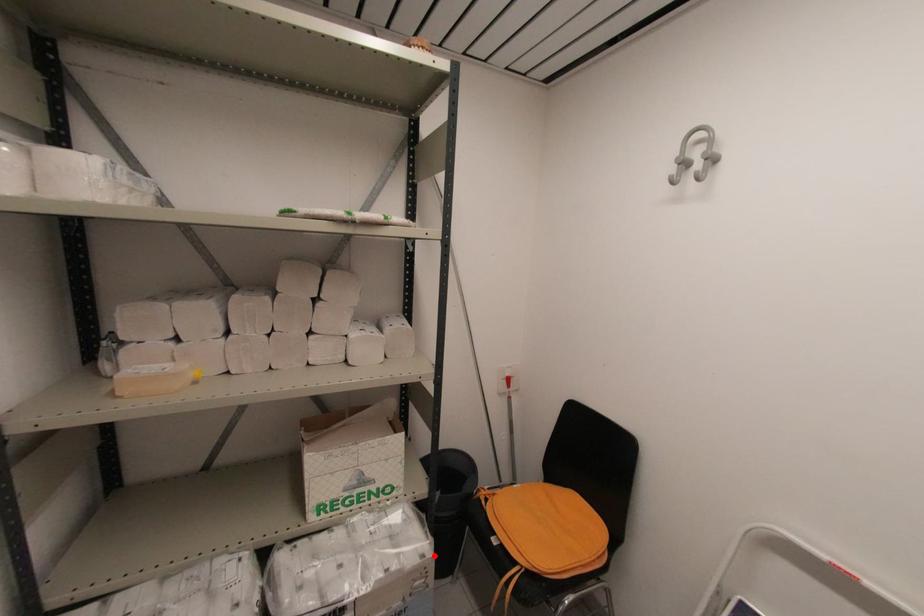
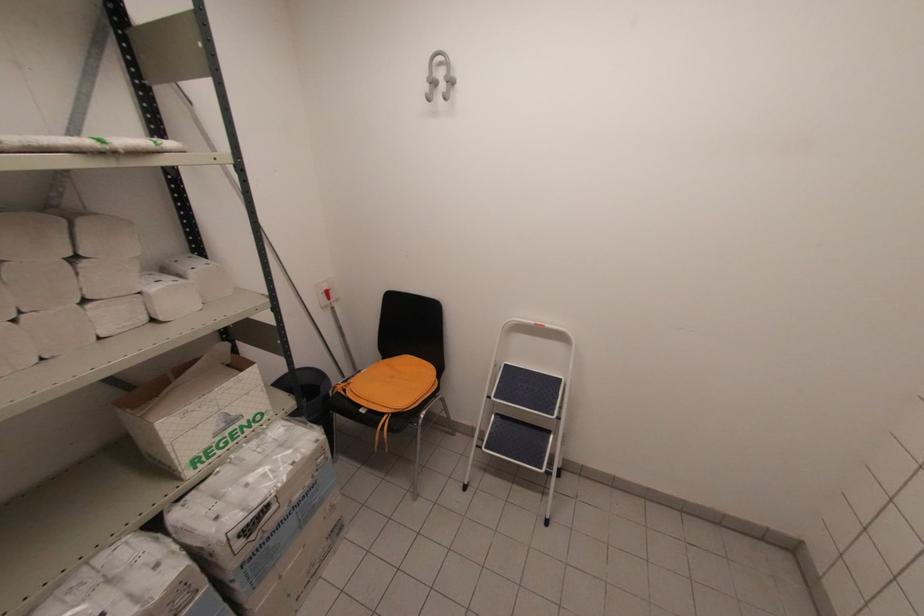
Question: I am providing you with two images of the same scene from different viewpoints. In image1, a red point is highlighted. Considering the same 3D point in image2, which of the following is correct?

Choices:
 (A) It is closer
 (B) It is farther

Answer: (A)